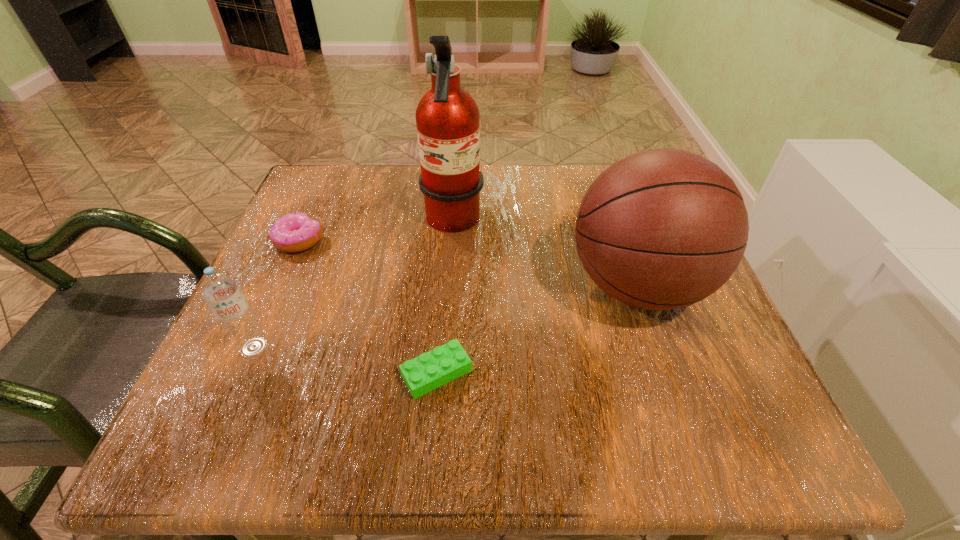
Locate an element on the screen. Image resolution: width=960 pixels, height=540 pixels. free space between the water bottle and the second tallest object is located at coordinates (445, 316).

Locate an element on the screen. The height and width of the screenshot is (540, 960). object that is the fourth closest to the rightmost object is located at coordinates (220, 290).

Select which object is the third closest to the rightmost object. Please provide its 2D coordinates. Your answer should be formatted as a tuple, i.e. [(x, y)], where the tuple contains the x and y coordinates of a point satisfying the conditions above.

[(295, 232)]

This screenshot has height=540, width=960. I want to click on vacant position in the image that satisfies the following two spatial constraints: 1. on the nozzle and handle of the fire extinguisher; 2. on the front side of the shortest object, so click(443, 373).

This screenshot has width=960, height=540. I want to click on vacant space that satisfies the following two spatial constraints: 1. on the front side of the rightmost object; 2. on the right side of the doughnut, so click(x=279, y=286).

The image size is (960, 540). Identify the location of vacant space that satisfies the following two spatial constraints: 1. on the nozzle and handle of the tallest object; 2. on the front side of the Lego. (443, 373).

I want to click on blank space that satisfies the following two spatial constraints: 1. on the nozzle and handle of the fourth shortest object; 2. on the left side of the fire extinguisher, so click(x=448, y=286).